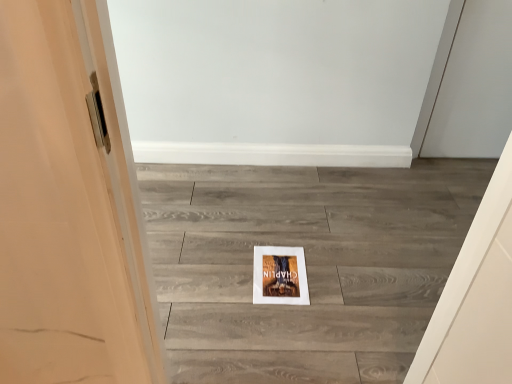
This screenshot has height=384, width=512. Identify the location of free space above matte paper flyer at center (from a real-world perspective). (274, 268).